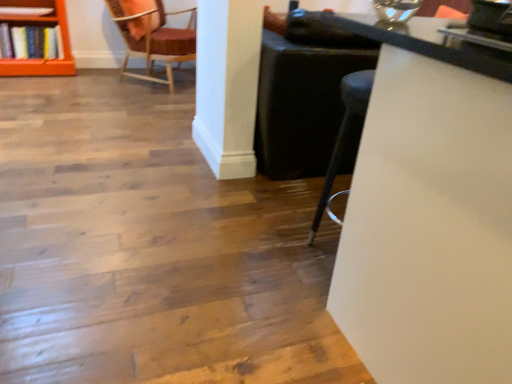
In order to face white glossy table at upper right, should I rotate leftwards or rightwards?

You should rotate right by 34.219 degrees.

The image size is (512, 384). I want to click on velvet-like burgundy chair at upper left, so click(153, 37).

The image size is (512, 384). I want to click on orange wood shelf at upper left, so (41, 25).

What's the angular difference between orange wood shelf at upper left and velvet-like burgundy chair at upper left's facing directions?

The angle between the facing direction of orange wood shelf at upper left and the facing direction of velvet-like burgundy chair at upper left is 44.7 degrees.

Is orange wood shelf at upper left beside velvet-like burgundy chair at upper left?

orange wood shelf at upper left and velvet-like burgundy chair at upper left are not in contact.

Which is more to the left, orange wood shelf at upper left or velvet-like burgundy chair at upper left?

From the viewer's perspective, orange wood shelf at upper left appears more on the left side.

Considering the relative sizes of orange wood shelf at upper left and velvet-like burgundy chair at upper left in the image provided, is orange wood shelf at upper left bigger than velvet-like burgundy chair at upper left?

Actually, orange wood shelf at upper left might be smaller than velvet-like burgundy chair at upper left.

Considering the positions of points (56, 46) and (121, 34), is point (56, 46) farther from camera compared to point (121, 34)?

No.

From a real-world perspective, who is located higher, hardcover books at left or velvet-like burgundy chair at upper left?

In real-world perspective, velvet-like burgundy chair at upper left is above.

Who is smaller, hardcover books at left or velvet-like burgundy chair at upper left?

hardcover books at left is smaller.

Considering the relative sizes of hardcover books at left and velvet-like burgundy chair at upper left in the image provided, is hardcover books at left taller than velvet-like burgundy chair at upper left?

Incorrect, the height of hardcover books at left is not larger of that of velvet-like burgundy chair at upper left.

Based on the photo, from the image's perspective, which is above, orange wood shelf at upper left or hardcover books at left?

orange wood shelf at upper left is shown above in the image.

Between orange wood shelf at upper left and hardcover books at left, which one has more height?

Standing taller between the two is orange wood shelf at upper left.

Does orange wood shelf at upper left appear on the left side of hardcover books at left?

No.

Is point (48, 65) less distant than point (45, 54)?

No, it is behind (45, 54).

Which is behind, point (479, 333) or point (155, 47)?

Point (155, 47)

From the image's perspective, would you say white glossy table at upper right is positioned over velvet-like burgundy chair at upper left?

No, from the image's perspective, white glossy table at upper right is not on top of velvet-like burgundy chair at upper left.

In the scene shown: Is white glossy table at upper right beside velvet-like burgundy chair at upper left?

No, white glossy table at upper right is not with velvet-like burgundy chair at upper left.

Can you tell me how much white glossy table at upper right and velvet-like burgundy chair at upper left differ in facing direction?

The facing directions of white glossy table at upper right and velvet-like burgundy chair at upper left are 44.5 degrees apart.

Does velvet-like burgundy chair at upper left have a smaller size compared to white glossy table at upper right?

Yes, velvet-like burgundy chair at upper left is smaller than white glossy table at upper right.

Identify the location of chair to the left of white glossy table at upper right. This screenshot has width=512, height=384. (153, 37).

Is point (109, 6) farther from viewer compared to point (400, 32)?

Yes, it is.

From the image's perspective, between velvet-like burgundy chair at upper left and white glossy table at upper right, which one is located above?

velvet-like burgundy chair at upper left is shown above in the image.

Measure the distance between velvet-like burgundy chair at upper left and hardcover books at left.

32.39 inches.

Is velvet-like burgundy chair at upper left closer to the viewer compared to hardcover books at left?

Yes, the depth of velvet-like burgundy chair at upper left is less than that of hardcover books at left.

Is velvet-like burgundy chair at upper left bigger or smaller than hardcover books at left?

Clearly, velvet-like burgundy chair at upper left is larger in size than hardcover books at left.

In the scene shown: Considering the relative sizes of velvet-like burgundy chair at upper left and hardcover books at left in the image provided, is velvet-like burgundy chair at upper left taller than hardcover books at left?

Indeed, velvet-like burgundy chair at upper left has a greater height compared to hardcover books at left.

Is the position of orange wood shelf at upper left more distant than that of white glossy table at upper right?

Yes, it is behind white glossy table at upper right.

This screenshot has height=384, width=512. In order to click on shelf on the left of white glossy table at upper right in this screenshot , I will do `click(41, 25)`.

Which is in front, point (26, 68) or point (439, 211)?

The point (439, 211) is closer.

The height and width of the screenshot is (384, 512). There is a orange wood shelf at upper left. What are the coordinates of `chair above it (from a real-world perspective)` in the screenshot? It's located at click(153, 37).

You are a GUI agent. You are given a task and a screenshot of the screen. Output one action in this format:
    pyautogui.click(x=<x>, y=<y>)
    Task: Click on the chair in front of the hardcover books at left
    This screenshot has height=384, width=512.
    Given the screenshot: What is the action you would take?
    pyautogui.click(x=153, y=37)

Considering their positions, is orange wood shelf at upper left positioned closer to white glossy table at upper right than velvet-like burgundy chair at upper left?

velvet-like burgundy chair at upper left lies closer to white glossy table at upper right than the other object.

When comparing their distances from velvet-like burgundy chair at upper left, does orange wood shelf at upper left or hardcover books at left seem closer?

orange wood shelf at upper left is closer to velvet-like burgundy chair at upper left.

Estimate the real-world distances between objects in this image. Which object is closer to hardcover books at left, white glossy table at upper right or velvet-like burgundy chair at upper left?

velvet-like burgundy chair at upper left is closer to hardcover books at left.

From the image, which object appears to be farther from velvet-like burgundy chair at upper left, hardcover books at left or white glossy table at upper right?

white glossy table at upper right.

Considering their positions, is white glossy table at upper right positioned further to orange wood shelf at upper left than hardcover books at left?

Among the two, white glossy table at upper right is located further to orange wood shelf at upper left.

Based on their spatial positions, is hardcover books at left or orange wood shelf at upper left closer to white glossy table at upper right?

orange wood shelf at upper left lies closer to white glossy table at upper right than the other object.

When comparing their distances from white glossy table at upper right, does hardcover books at left or velvet-like burgundy chair at upper left seem further?

hardcover books at left is further to white glossy table at upper right.

Looking at the image, which one is located further to orange wood shelf at upper left, velvet-like burgundy chair at upper left or white glossy table at upper right?

white glossy table at upper right is positioned further to the anchor orange wood shelf at upper left.

The image size is (512, 384). Identify the location of shelf between hardcover books at left and velvet-like burgundy chair at upper left in the horizontal direction. (41, 25).

Locate an element on the screen. chair positioned between white glossy table at upper right and hardcover books at left from near to far is located at coordinates (153, 37).

At what (x,y) coordinates should I click in order to perform the action: click on chair located between white glossy table at upper right and orange wood shelf at upper left in the depth direction. Please return your answer as a coordinate pair (x, y). Looking at the image, I should click on (153, 37).

At what (x,y) coordinates should I click in order to perform the action: click on shelf positioned between white glossy table at upper right and hardcover books at left from near to far. Please return your answer as a coordinate pair (x, y). Looking at the image, I should click on (41, 25).